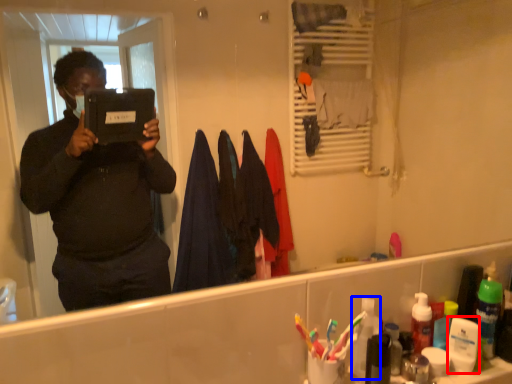
Question: Which of the following is the farthest to the observer, toiletry (highlighted by a red box) or toiletry (highlighted by a blue box)?

Choices:
 (A) toiletry
 (B) toiletry

Answer: (A)